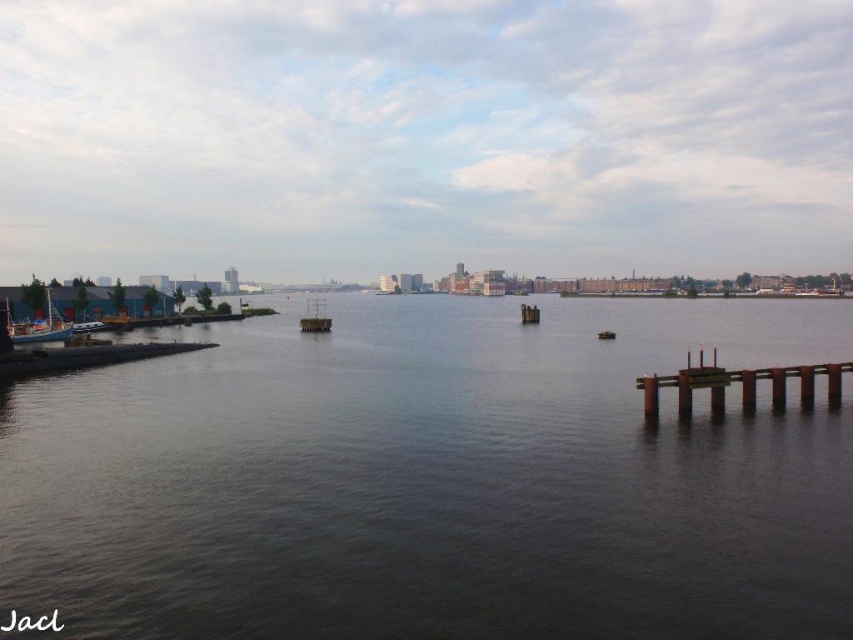
You are planning to sail a toy boat that is 1 meter long. You see the dark water at center and the wooden boat at left in the scene. Which area can accommodate your toy boat if it needs a space larger than 1 meter?

The dark water at center has a larger size compared to wooden boat at left, so the dark water at center can accommodate the toy boat as it requires a space larger than 1 meter.

You are standing at the shore looking out towards the water. There are two points marked on the image. The first point is at coordinates point (x=776, y=381) and the second is at point (x=39, y=285). Which point is closer to you?

Point (x=776, y=381) is in front of point (x=39, y=285), so it is closer to you.